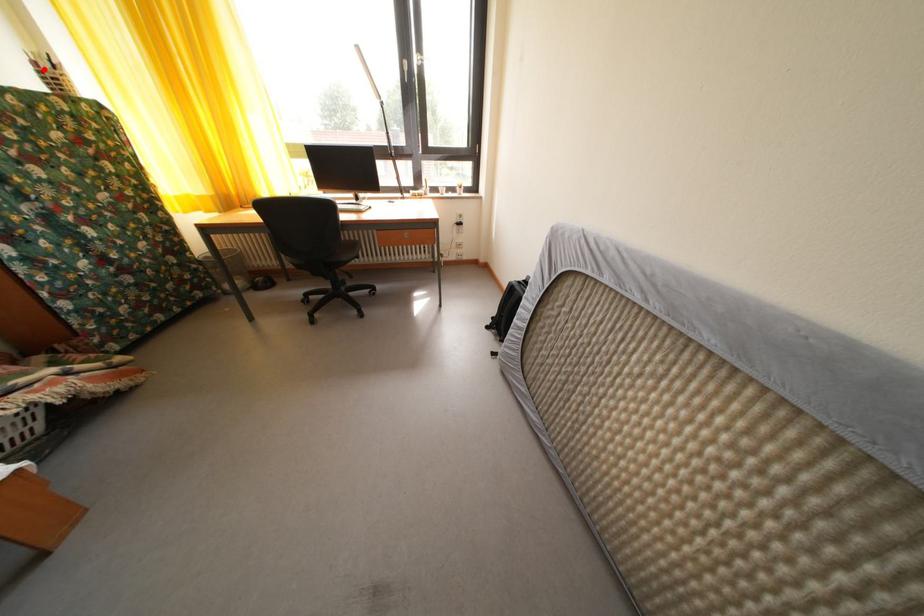
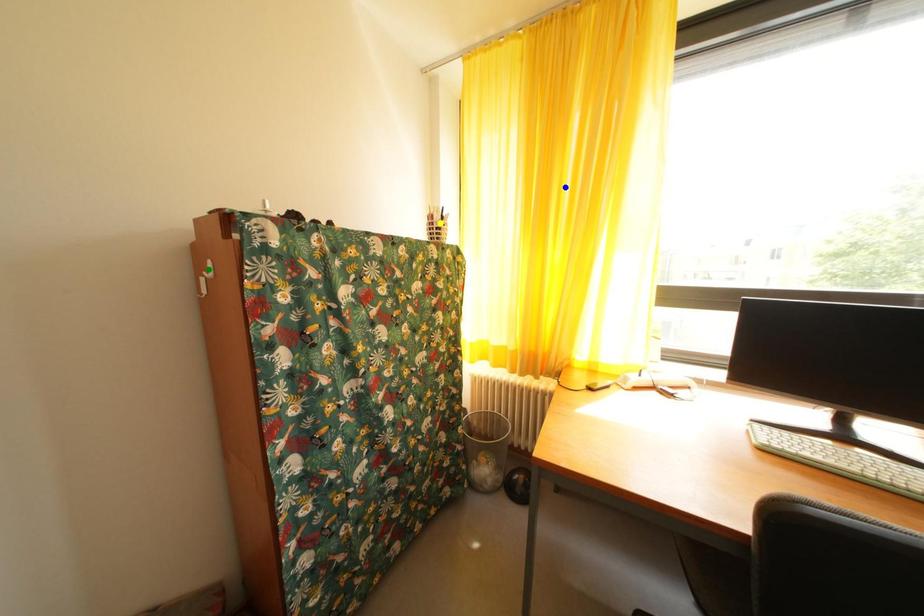
Question: I am providing you with two images of the same scene from different viewpoints. A red point is marked on the first image. You are given multiple points on the second image. Which point in image 2 is actually the same real-world point as the red point in image 1?

Choices:
 (A) green point
 (B) yellow point
 (C) blue point

Answer: (B)